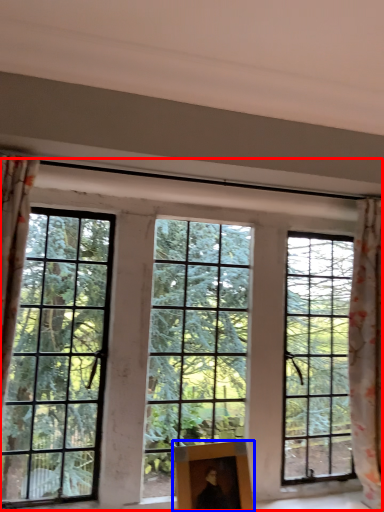
Question: Which point is closer to the camera, window (highlighted by a red box) or picture frame (highlighted by a blue box)?

Choices:
 (A) window
 (B) picture frame

Answer: (B)